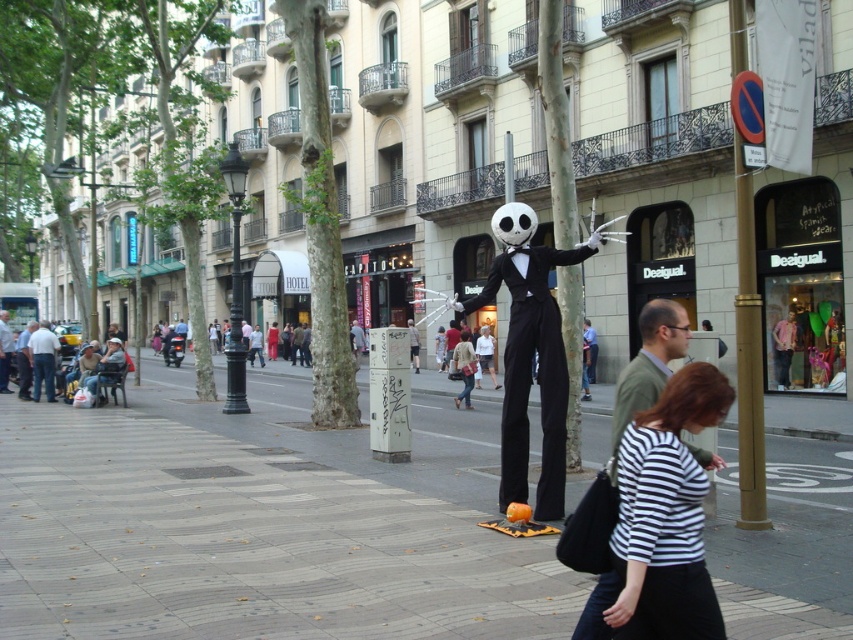
Question: Which of the following is the farthest from the observer?

Choices:
 (A) (532, 221)
 (B) (705, 490)

Answer: (A)

Question: Considering the relative positions of smooth concrete sidewalk at center and striped fabric shirt at lower right in the image provided, where is smooth concrete sidewalk at center located with respect to striped fabric shirt at lower right?

Choices:
 (A) below
 (B) above

Answer: (A)

Question: Observing the image, what is the correct spatial positioning of striped fabric shirt at lower right in reference to gold polished pole at right?

Choices:
 (A) below
 (B) above

Answer: (A)

Question: Does smooth concrete sidewalk at center come behind matte black skeleton at center?

Choices:
 (A) yes
 (B) no

Answer: (B)

Question: Which object is positioned closest to the striped fabric shirt at lower right?

Choices:
 (A) smooth concrete sidewalk at center
 (B) gold polished pole at right
 (C) matte black skeleton at center

Answer: (A)

Question: Estimate the real-world distances between objects in this image. Which object is closer to the smooth concrete sidewalk at center?

Choices:
 (A) gold polished pole at right
 (B) matte black skeleton at center

Answer: (B)